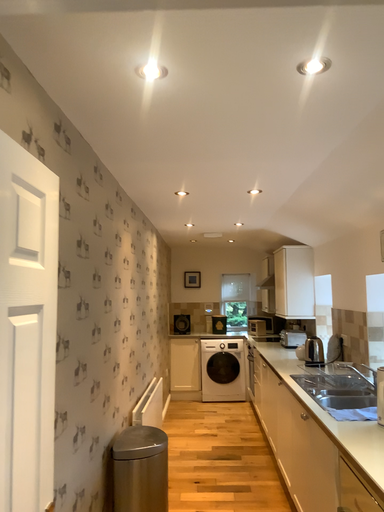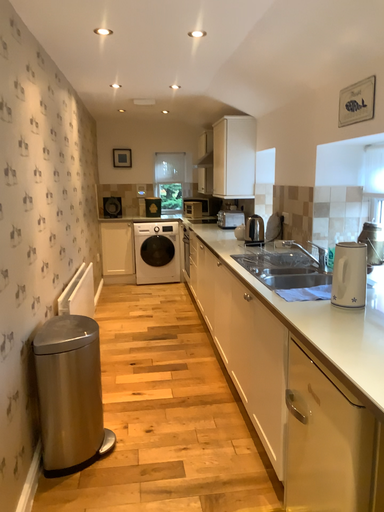
Question: Which way did the camera rotate in the video?

Choices:
 (A) rotated right
 (B) rotated left

Answer: (A)